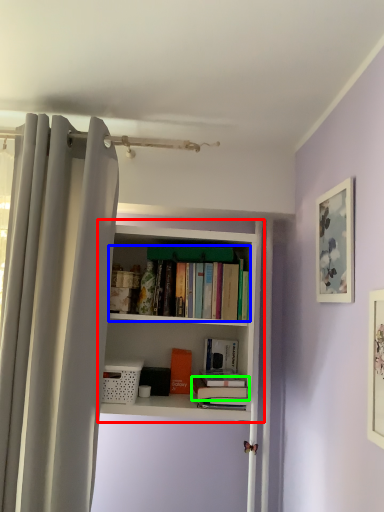
Question: Which is farther away from bookcase (highlighted by a red box)? book (highlighted by a blue box) or book (highlighted by a green box)?

Choices:
 (A) book
 (B) book

Answer: (B)